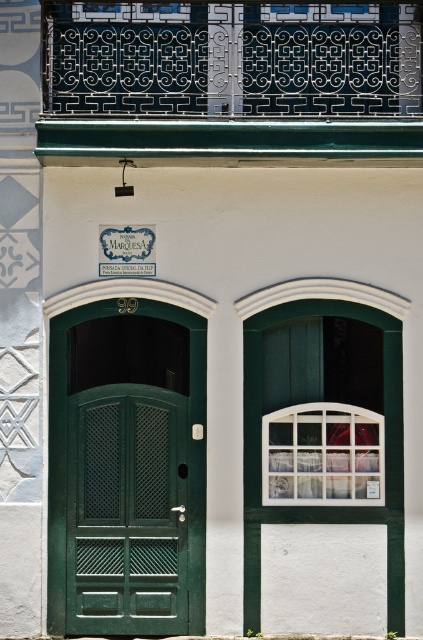
Question: Can you confirm if white glass window at center is positioned to the right of metallic glass window at upper center?

Choices:
 (A) no
 (B) yes

Answer: (B)

Question: Can you confirm if green matte door at left is positioned above metallic glass window at upper center?

Choices:
 (A) yes
 (B) no

Answer: (B)

Question: Can you confirm if black wrought iron at upper center is positioned to the right of white glass window at center?

Choices:
 (A) yes
 (B) no

Answer: (B)

Question: Among these points, which one is nearest to the camera?

Choices:
 (A) (87, 10)
 (B) (255, 97)

Answer: (B)

Question: Which object appears closest to the camera in this image?

Choices:
 (A) green matte door at left
 (B) metallic glass window at upper center
 (C) black wrought iron at upper center

Answer: (C)

Question: Which point is farther to the camera?

Choices:
 (A) (198, 378)
 (B) (362, 74)

Answer: (A)